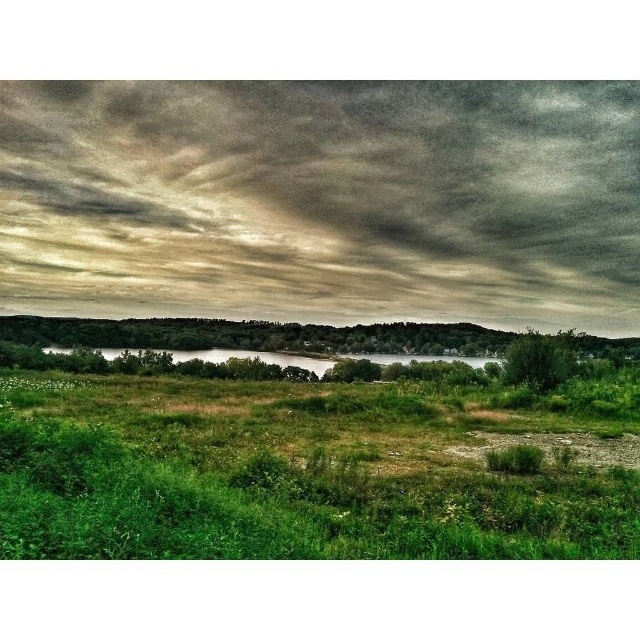
In the scene shown: Does gray/cloudy sky at upper center have a greater width compared to green grass at center?

Indeed, gray/cloudy sky at upper center has a greater width compared to green grass at center.

Is point (611, 152) farther from camera compared to point (566, 550)?

Yes, point (611, 152) is behind point (566, 550).

Who is more distant from viewer, (410, 262) or (339, 387)?

Point (410, 262)

You are a GUI agent. You are given a task and a screenshot of the screen. Output one action in this format:
    pyautogui.click(x=<x>, y=<y>)
    Task: Click on the gray/cloudy sky at upper center
    The height and width of the screenshot is (640, 640).
    Given the screenshot: What is the action you would take?
    pyautogui.click(x=323, y=200)